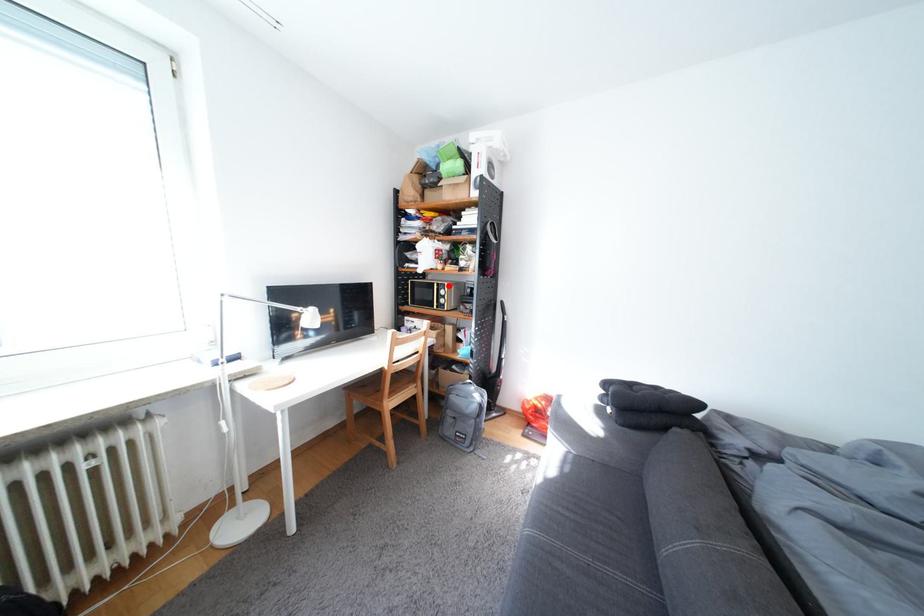
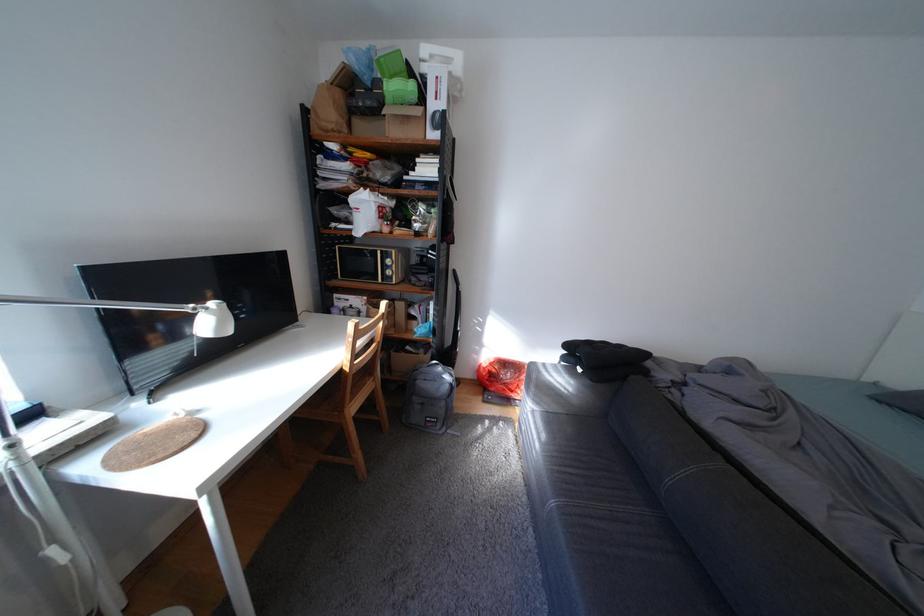
Find the pixel in the second image that matches the highlighted location in the first image.

(392, 253)